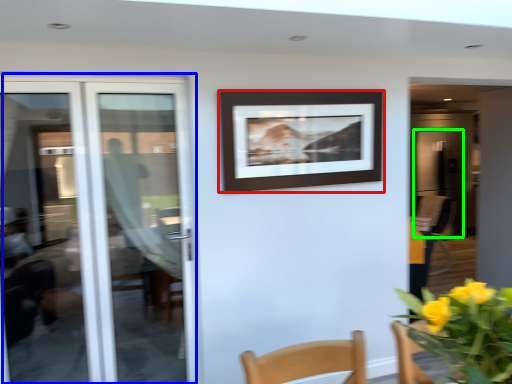
Question: Which object is the closest to the picture frame (highlighted by a red box)? Choose among these: door (highlighted by a blue box) or screen door (highlighted by a green box).

Choices:
 (A) door
 (B) screen door

Answer: (A)